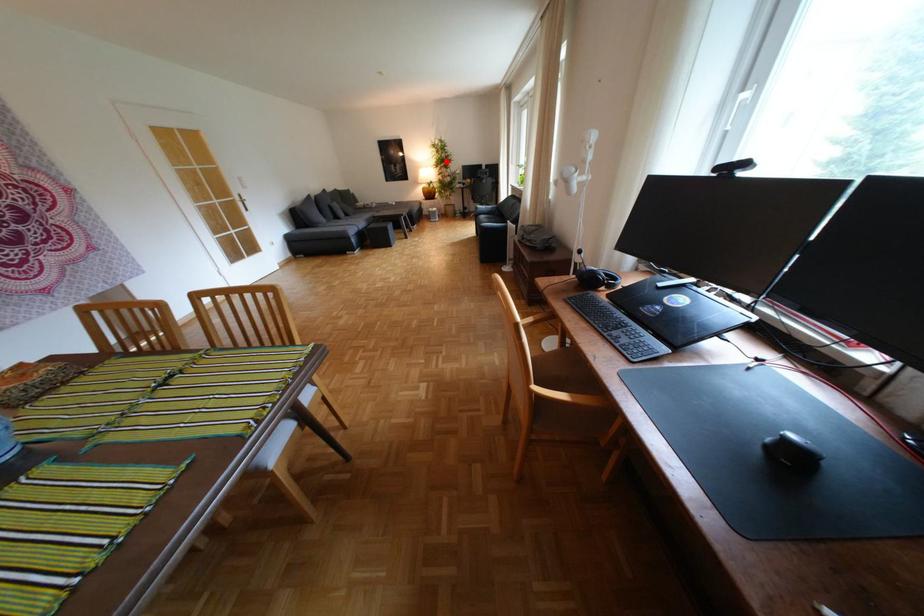
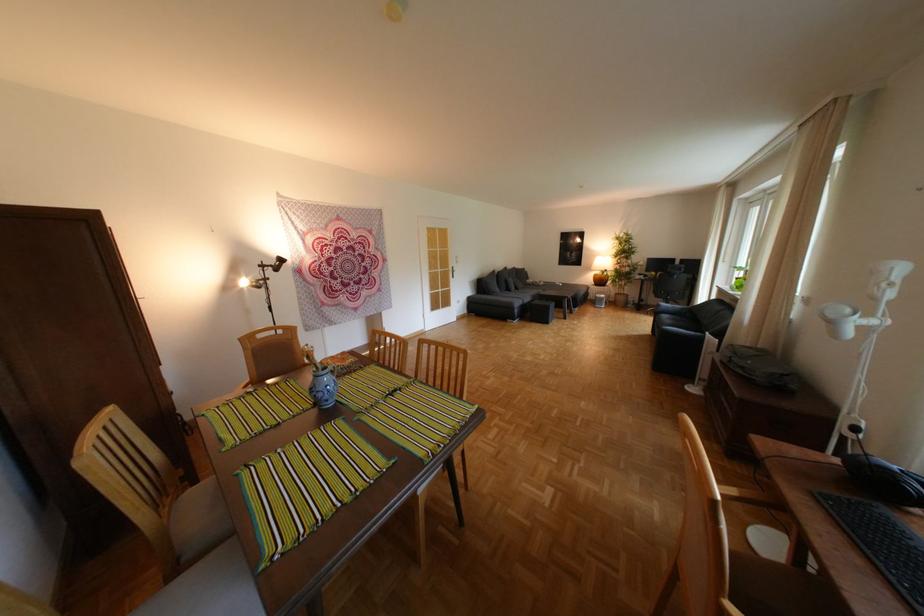
Locate, in the second image, the point that corresponds to the highlighted location in the first image.

(626, 252)